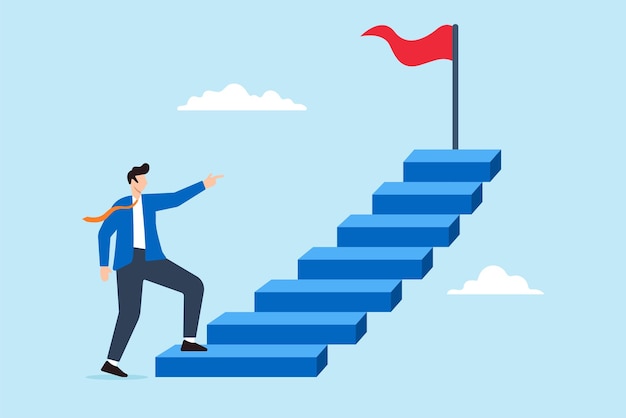
Locate an element on the screen. The image size is (626, 418). stairs is located at coordinates 233,340, 280,318, 310,288, 344,254, 380,222, 416,186, 446,164.